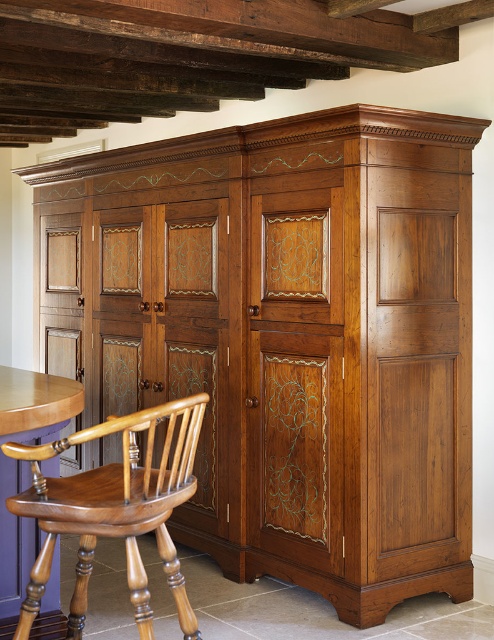
Between point (165, 452) and point (36, 438), which one is positioned behind?

The point (36, 438) is behind.

Between polished wood captain's chair at lower left and mahogany table at lower left, which one appears on the left side from the viewer's perspective?

mahogany table at lower left

At what (x,y) coordinates should I click in order to perform the action: click on polished wood captain's chair at lower left. Please return your answer as a coordinate pair (x, y). Looking at the image, I should click on (114, 508).